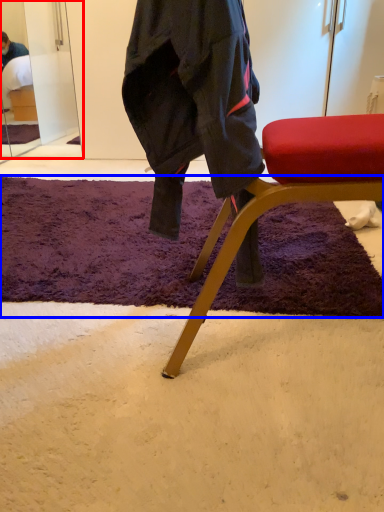
Question: Which object appears closest to the camera in this image, mirror (highlighted by a red box) or mat (highlighted by a blue box)?

Choices:
 (A) mirror
 (B) mat

Answer: (B)